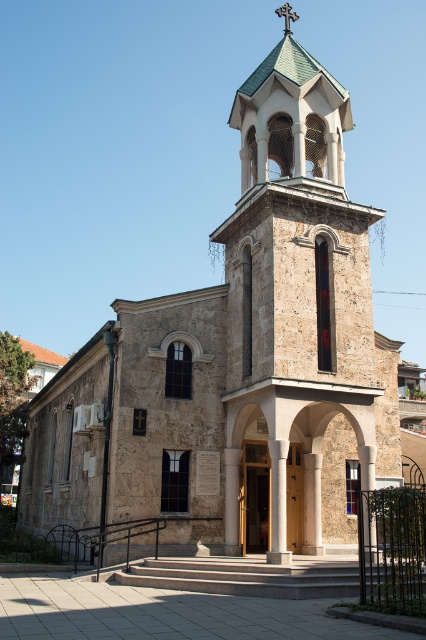
Question: Does stone steeple at center appear on the left side of green tile spire at upper center?

Choices:
 (A) no
 (B) yes

Answer: (A)

Question: Does stone steeple at center have a smaller size compared to green tile spire at upper center?

Choices:
 (A) no
 (B) yes

Answer: (B)

Question: Among these objects, which one is nearest to the camera?

Choices:
 (A) green tile spire at upper center
 (B) stone steeple at center

Answer: (B)

Question: Which point is farther to the camera?

Choices:
 (A) green tile spire at upper center
 (B) stone steeple at center

Answer: (A)

Question: Does stone steeple at center have a lesser width compared to green tile spire at upper center?

Choices:
 (A) no
 (B) yes

Answer: (A)